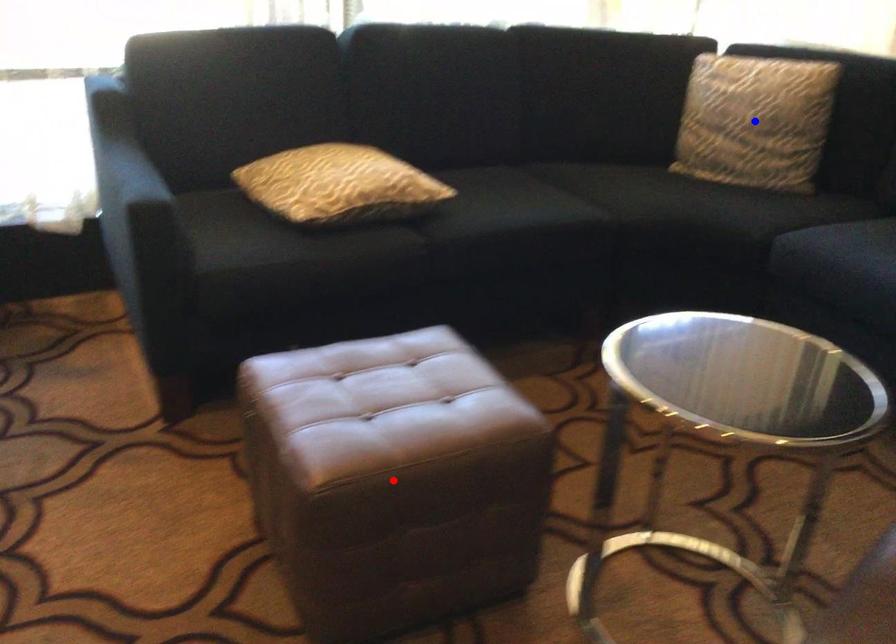
Question: Which of the two points in the image is closer to the camera?

Choices:
 (A) Blue point is closer.
 (B) Red point is closer.

Answer: (B)